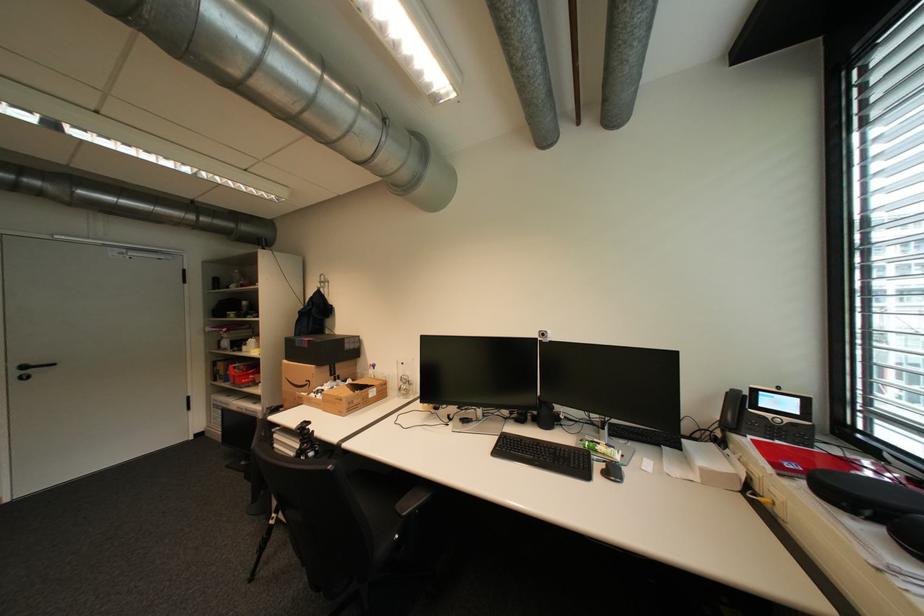
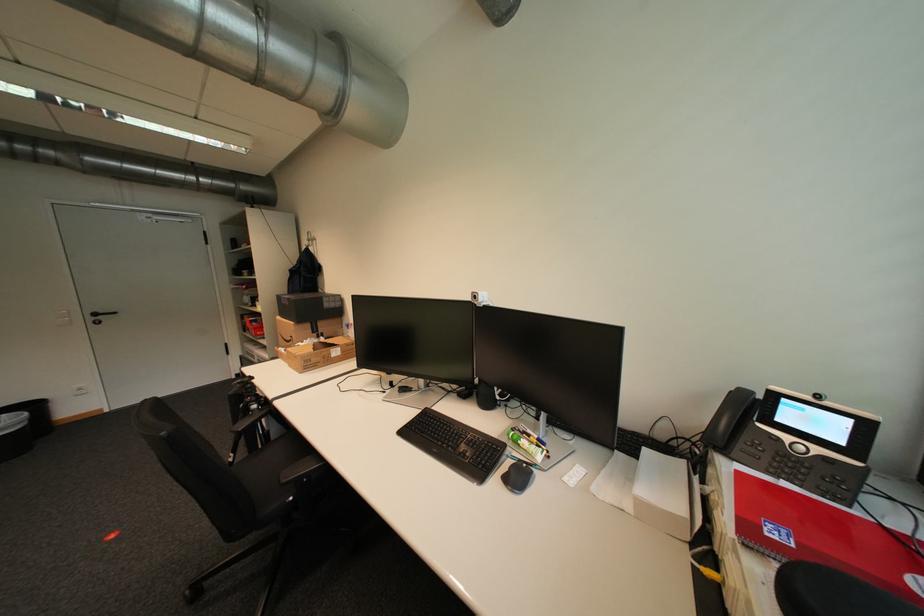
Where in the second image is the point corresponding to [787,476] from the first image?

(754, 545)